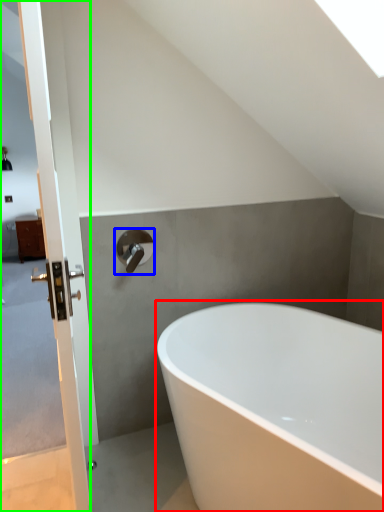
Question: Based on their relative distances, which object is farther from bathtub (highlighted by a red box)? Choose from tap (highlighted by a blue box) and screen door (highlighted by a green box).

Choices:
 (A) tap
 (B) screen door

Answer: (B)